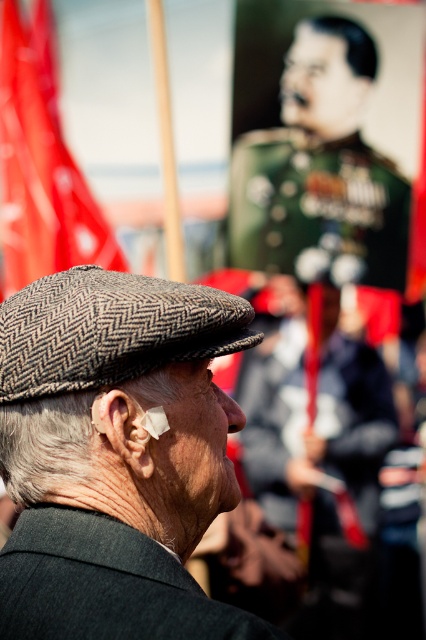
Is green military uniform at upper center taller than red fabric flag at upper left?

No.

Is green military uniform at upper center bigger than red fabric flag at upper left?

No, green military uniform at upper center is not bigger than red fabric flag at upper left.

In order to click on green military uniform at upper center in this screenshot , I will do `click(319, 170)`.

Find the location of `dark gray woolen suit at center`. dark gray woolen suit at center is located at coordinates (106, 584).

Is dark gray woolen suit at center bigger than red fabric flag at upper left?

Actually, dark gray woolen suit at center might be smaller than red fabric flag at upper left.

What do you see at coordinates (106, 584) in the screenshot? I see `dark gray woolen suit at center` at bounding box center [106, 584].

At what (x,y) coordinates should I click in order to perform the action: click on dark gray woolen suit at center. Please return your answer as a coordinate pair (x, y). Looking at the image, I should click on (106, 584).

Can you confirm if green military uniform at upper center is positioned below herringbone fabric hat at center?

No, green military uniform at upper center is not below herringbone fabric hat at center.

Which is more to the left, green military uniform at upper center or herringbone fabric hat at center?

Positioned to the left is herringbone fabric hat at center.

Is point (236, 195) closer to viewer compared to point (106, 284)?

No, (236, 195) is behind (106, 284).

You are a GUI agent. You are given a task and a screenshot of the screen. Output one action in this format:
    pyautogui.click(x=<x>, y=<y>)
    Task: Click on the green military uniform at upper center
    The width and height of the screenshot is (426, 640).
    Given the screenshot: What is the action you would take?
    pyautogui.click(x=319, y=170)